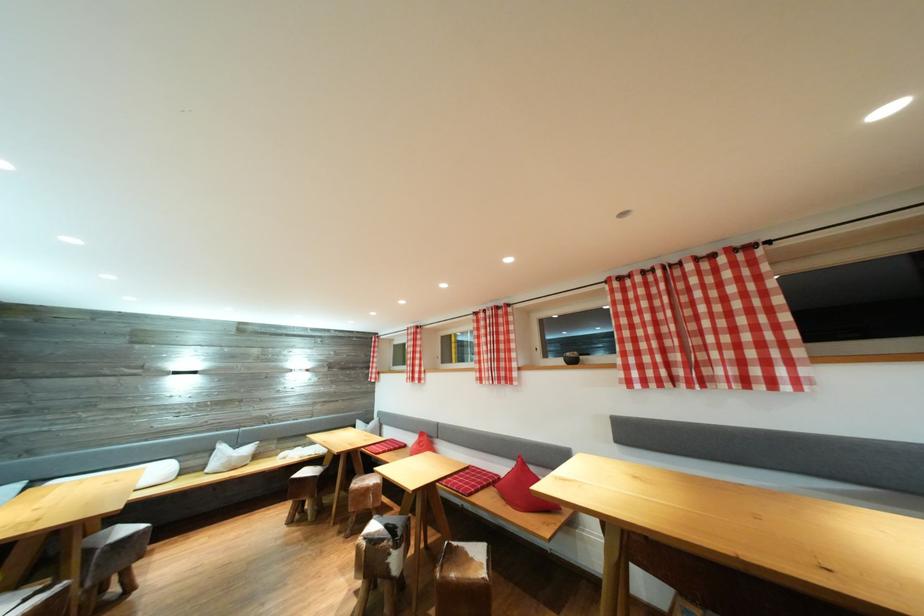
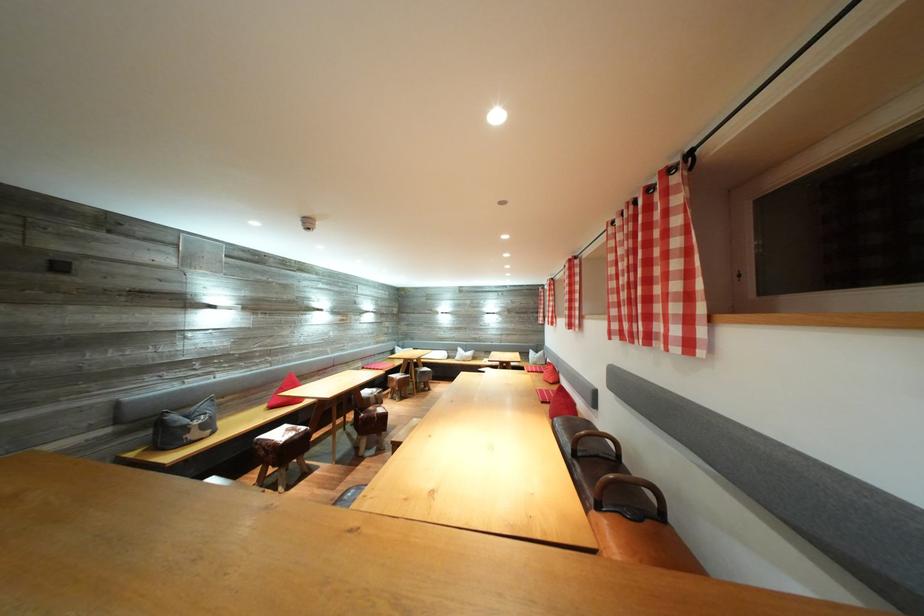
In the second image, find the point that corresponds to point 228,453 in the first image.

(467, 355)